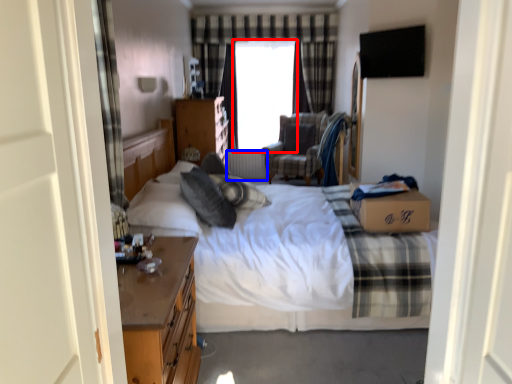
Question: Which point is closer to the camera, window screen (highlighted by a red box) or radiator (highlighted by a blue box)?

Choices:
 (A) window screen
 (B) radiator

Answer: (A)